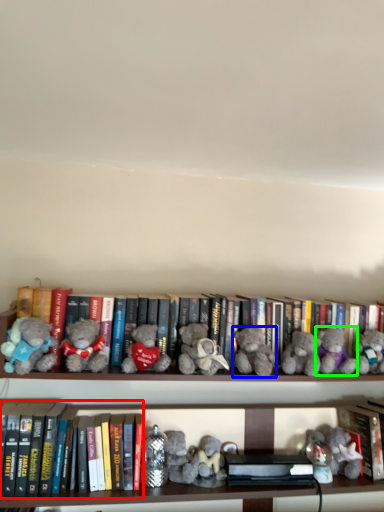
Question: Which is nearer to the book (highlighted by a red box)? teddy bear (highlighted by a blue box) or teddy bear (highlighted by a green box).

Choices:
 (A) teddy bear
 (B) teddy bear

Answer: (A)